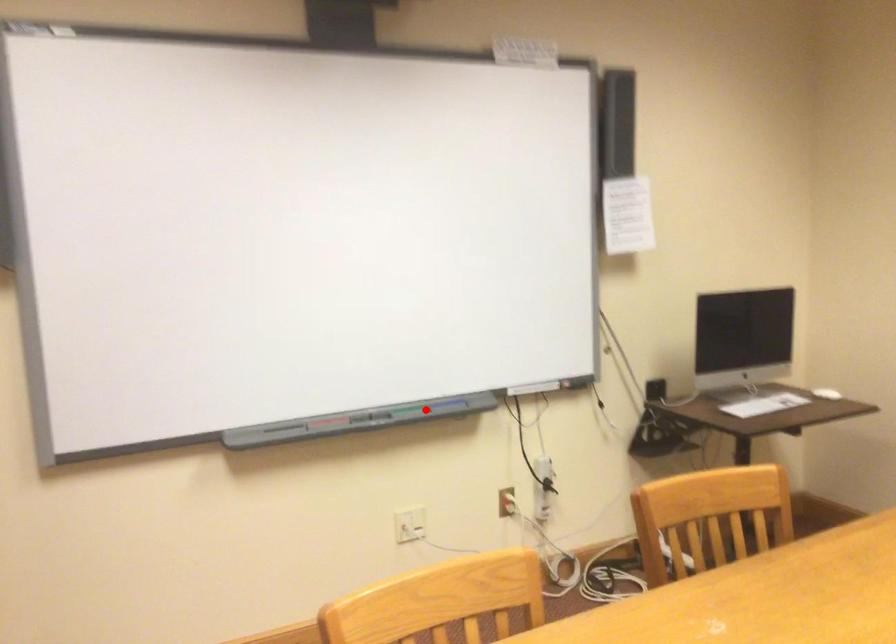
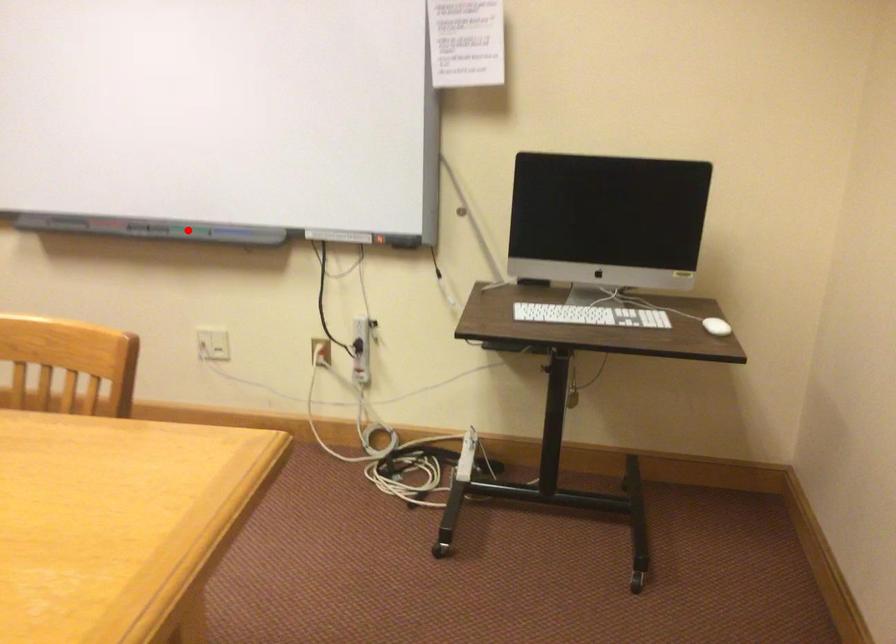
I am providing you with two images of the same scene from different viewpoints. A red point is marked on the first image and another point is marked on the second image. Does the point marked in image1 correspond to the same location as the one in image2?

Yes